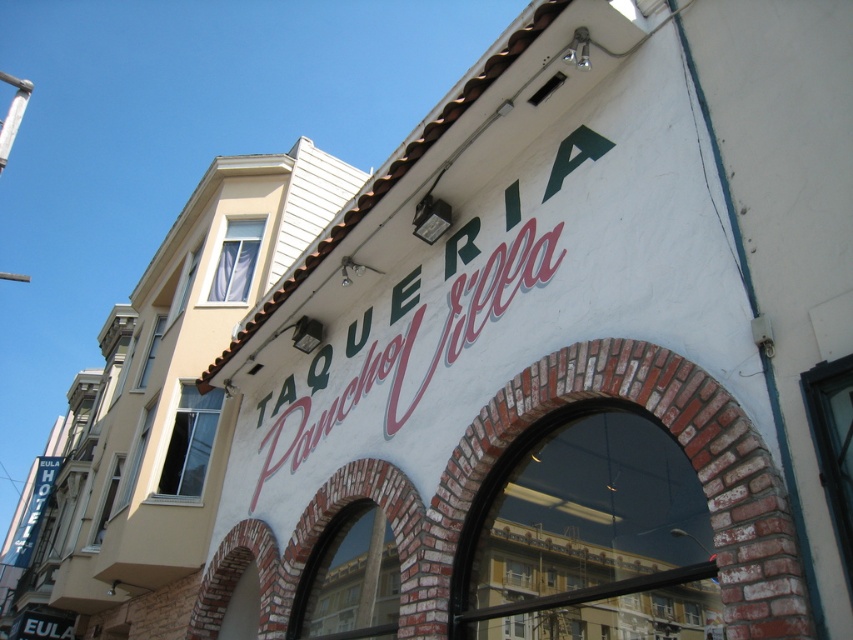
Question: Can you confirm if green painted sign at upper center is smaller than blue fabric hotel sign at left?

Choices:
 (A) yes
 (B) no

Answer: (A)

Question: Which point appears closest to the camera in this image?

Choices:
 (A) (35, 470)
 (B) (276, 422)

Answer: (B)

Question: Can you confirm if green painted sign at upper center is positioned to the left of blue fabric hotel sign at left?

Choices:
 (A) yes
 (B) no

Answer: (B)

Question: Where is green painted sign at upper center located in relation to blue fabric hotel sign at left in the image?

Choices:
 (A) right
 (B) left

Answer: (A)